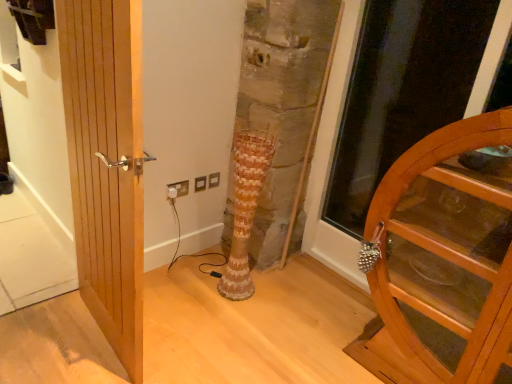
Question: Relative to transparent wooden door at right, is natural wood door at left, the second door when ordered from right to left, in front or behind?

Choices:
 (A) behind
 (B) front

Answer: (B)

Question: Based on their sizes in the image, would you say natural wood door at left, the second door when ordered from right to left, is bigger or smaller than transparent wooden door at right?

Choices:
 (A) small
 (B) big

Answer: (A)

Question: Which object is the closest to the wooden cabinet at right, which is the second door in left-to-right order?

Choices:
 (A) white plastic electric outlet at lower center
 (B) transparent wooden door at right
 (C) natural wood door at left, the second door when ordered from right to left
 (D) brown textured vase at center

Answer: (D)

Question: Estimate the real-world distances between objects in this image. Which object is closer to the brown textured vase at center?

Choices:
 (A) natural wood door at left, which is the first door from left to right
 (B) transparent wooden door at right
 (C) wooden cabinet at right, which is the second door in left-to-right order
 (D) white plastic electric outlet at lower center

Answer: (D)